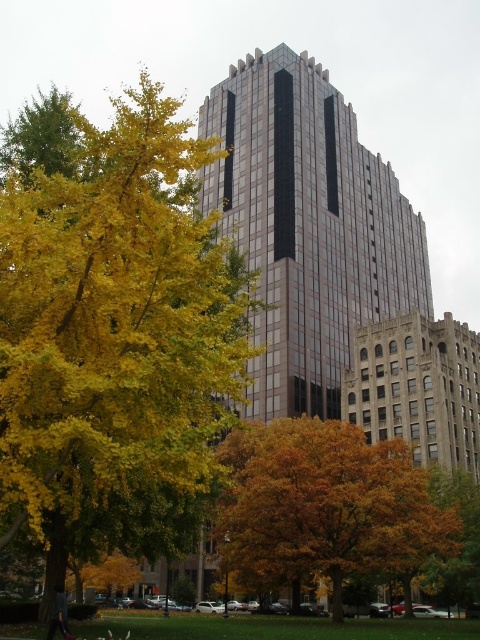
Question: Can you confirm if orange leafy tree at center is thinner than brown stone building at center?

Choices:
 (A) yes
 (B) no

Answer: (B)

Question: Which object is closer to the camera taking this photo?

Choices:
 (A) brown stone building at center
 (B) glassy brown building at center

Answer: (A)

Question: Based on their relative distances, which object is farther from the brown stone building at center?

Choices:
 (A) yellow-green leaves at left
 (B) glassy brown building at center

Answer: (A)

Question: Does glassy brown building at center come in front of orange leafy tree at center?

Choices:
 (A) yes
 (B) no

Answer: (B)

Question: Is glassy brown building at center in front of brown stone building at center?

Choices:
 (A) no
 (B) yes

Answer: (A)

Question: Which of the following is the farthest from the observer?

Choices:
 (A) (355, 356)
 (B) (342, 548)
 (C) (216, 417)

Answer: (A)